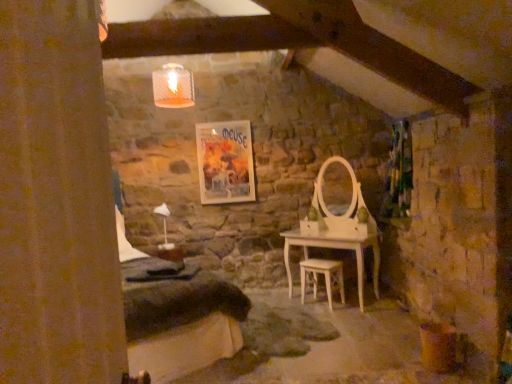
Question: Considering the relative sizes of light wood stool at center and matte paper poster at center in the image provided, is light wood stool at center bigger than matte paper poster at center?

Choices:
 (A) no
 (B) yes

Answer: (B)

Question: Is light wood stool at center thinner than matte paper poster at center?

Choices:
 (A) yes
 (B) no

Answer: (B)

Question: From a real-world perspective, does light wood stool at center sit lower than matte paper poster at center?

Choices:
 (A) yes
 (B) no

Answer: (A)

Question: From the image's perspective, is light wood stool at center over matte paper poster at center?

Choices:
 (A) yes
 (B) no

Answer: (B)

Question: Is light wood stool at center positioned behind matte paper poster at center?

Choices:
 (A) yes
 (B) no

Answer: (B)

Question: From a real-world perspective, is matte paper poster at center positioned above or below brown textured curtain at left, arranged as the second curtain when viewed from the right?

Choices:
 (A) below
 (B) above

Answer: (B)

Question: In the image, is matte paper poster at center on the left side or the right side of brown textured curtain at left, which ranks as the 1th curtain in left-to-right order?

Choices:
 (A) right
 (B) left

Answer: (B)

Question: From the image's perspective, is matte paper poster at center positioned above or below brown textured curtain at left, arranged as the second curtain when viewed from the right?

Choices:
 (A) above
 (B) below

Answer: (A)

Question: In the image, is matte paper poster at center positioned in front of or behind brown textured curtain at left, the first curtain when ordered from front to back?

Choices:
 (A) behind
 (B) front

Answer: (A)

Question: From the image's perspective, is light wood stool at center positioned above or below matte paper poster at center?

Choices:
 (A) below
 (B) above

Answer: (A)

Question: Is light wood stool at center inside or outside of matte paper poster at center?

Choices:
 (A) inside
 (B) outside

Answer: (B)

Question: Is light wood stool at center wider or thinner than matte paper poster at center?

Choices:
 (A) wide
 (B) thin

Answer: (A)

Question: From a real-world perspective, is light wood stool at center positioned above or below matte paper poster at center?

Choices:
 (A) below
 (B) above

Answer: (A)

Question: Is point (335, 264) positioned closer to the camera than point (407, 124)?

Choices:
 (A) farther
 (B) closer

Answer: (B)

Question: Considering the positions of light wood stool at center and green floral fabric curtain at right, the first curtain positioned from the back, in the image, is light wood stool at center bigger or smaller than green floral fabric curtain at right, the first curtain positioned from the back,?

Choices:
 (A) small
 (B) big

Answer: (A)